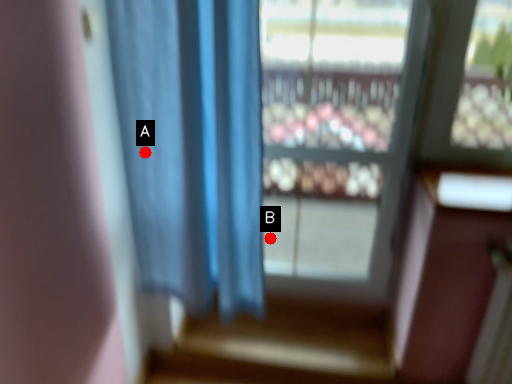
Question: Two points are circled on the image, labeled by A and B beside each circle. Which of the following is the closest to the observer?

Choices:
 (A) A is closer
 (B) B is closer

Answer: (A)